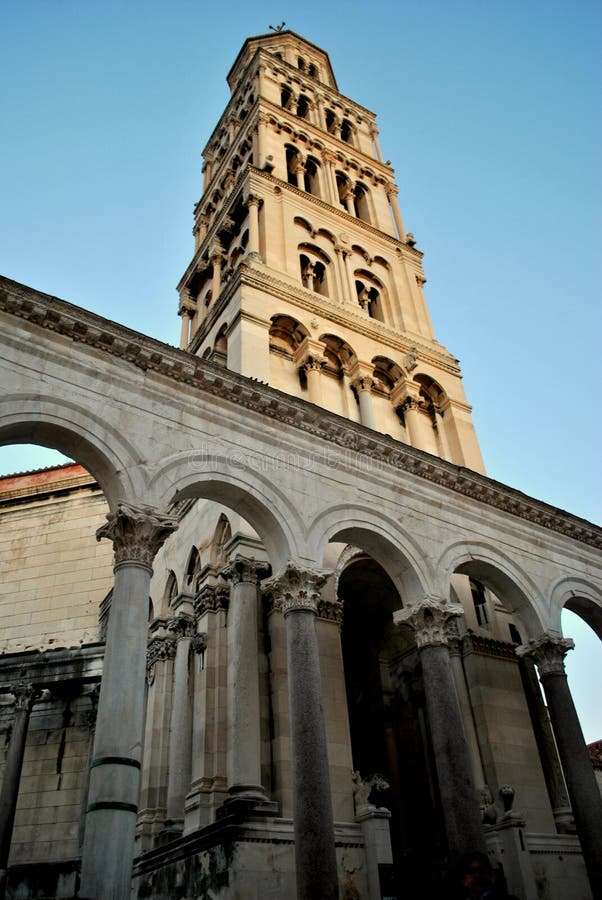
Identify the location of pillars. (111, 832), (315, 828), (461, 814), (583, 805).